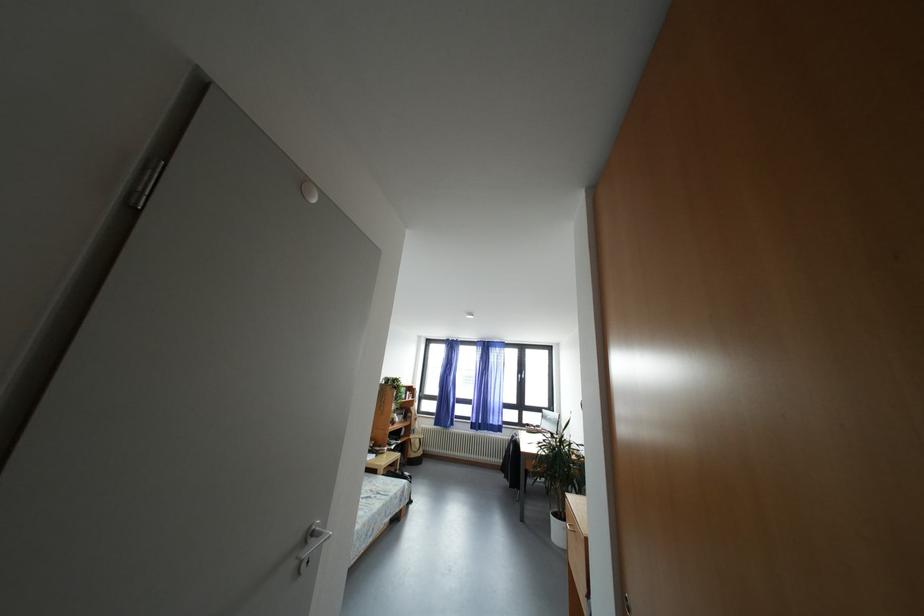
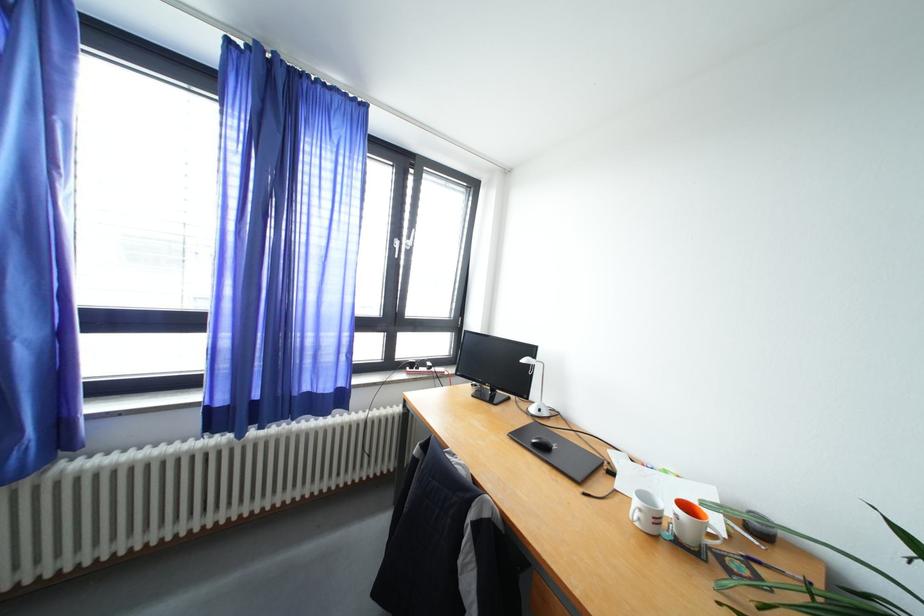
The point at (533, 430) is marked in the first image. Where is the corresponding point in the second image?

(419, 370)